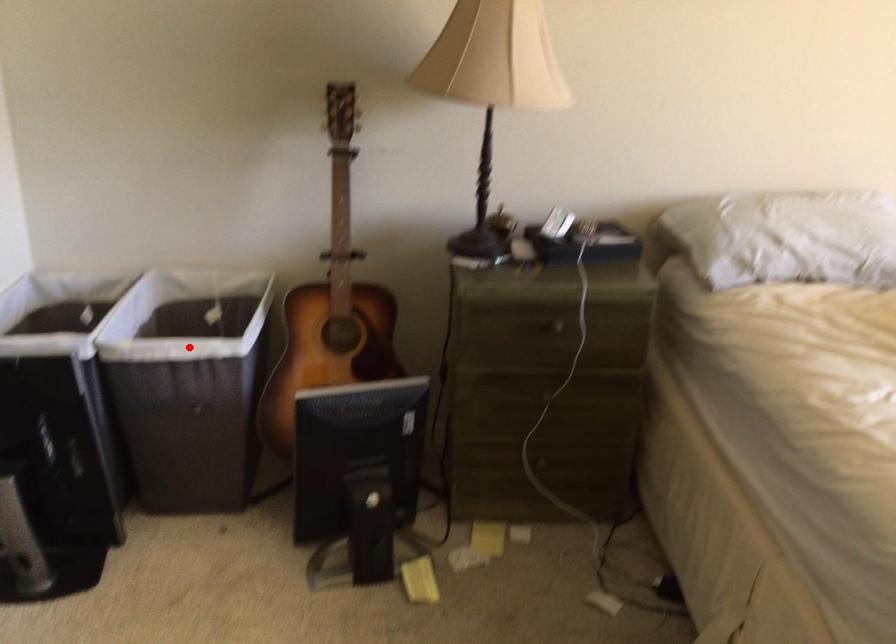
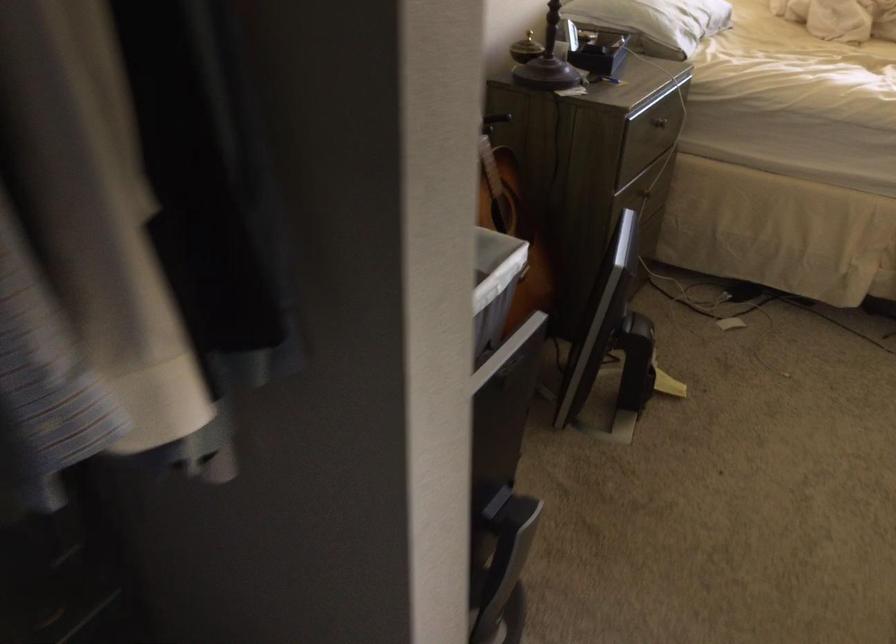
Question: A red point is marked in image1. In image2, is the corresponding 3D point closer to the camera or farther? Reply with the corresponding letter.

Choices:
 (A) The corresponding 3D point is closer.
 (B) The corresponding 3D point is farther.

Answer: (A)